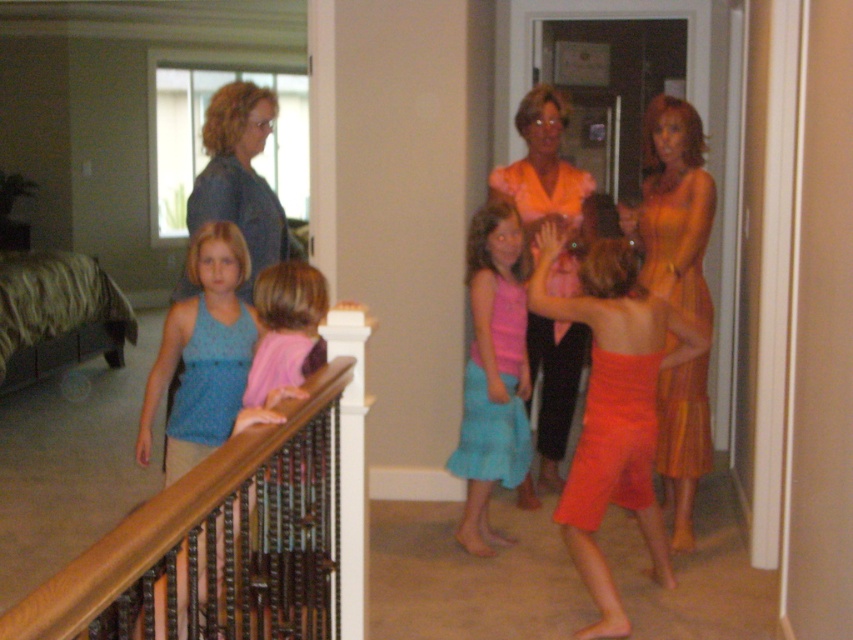
Is orange satin dress at center smaller than denim jacket at left?

No, orange satin dress at center is not smaller than denim jacket at left.

Who is higher up, orange satin dress at center or denim jacket at left?

denim jacket at left is above.

Image resolution: width=853 pixels, height=640 pixels. I want to click on orange satin dress at center, so click(x=625, y=365).

I want to click on orange satin dress at center, so click(625, 365).

Can you confirm if wooden at upper left is wider than orange satin dress at right?

Indeed, wooden at upper left has a greater width compared to orange satin dress at right.

Who is more forward, (357, 540) or (671, 474)?

Point (357, 540)

Does point (51, 480) come farther from viewer compared to point (646, 250)?

Yes, it is behind point (646, 250).

You are a GUI agent. You are given a task and a screenshot of the screen. Output one action in this format:
    pyautogui.click(x=<x>, y=<y>)
    Task: Click on the wooden at upper left
    The width and height of the screenshot is (853, 640).
    Given the screenshot: What is the action you would take?
    pyautogui.click(x=71, y=464)

Is matte blue tank top at left to the left of orange satin blouse at center from the viewer's perspective?

Correct, you'll find matte blue tank top at left to the left of orange satin blouse at center.

Can you confirm if matte blue tank top at left is taller than orange satin blouse at center?

No.

Where is `matte blue tank top at left`? matte blue tank top at left is located at coordinates (204, 355).